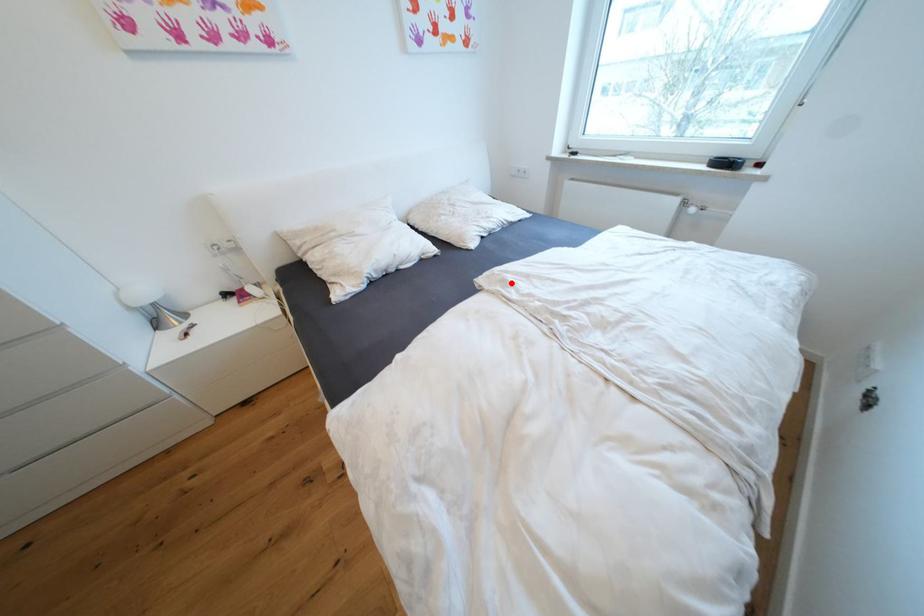
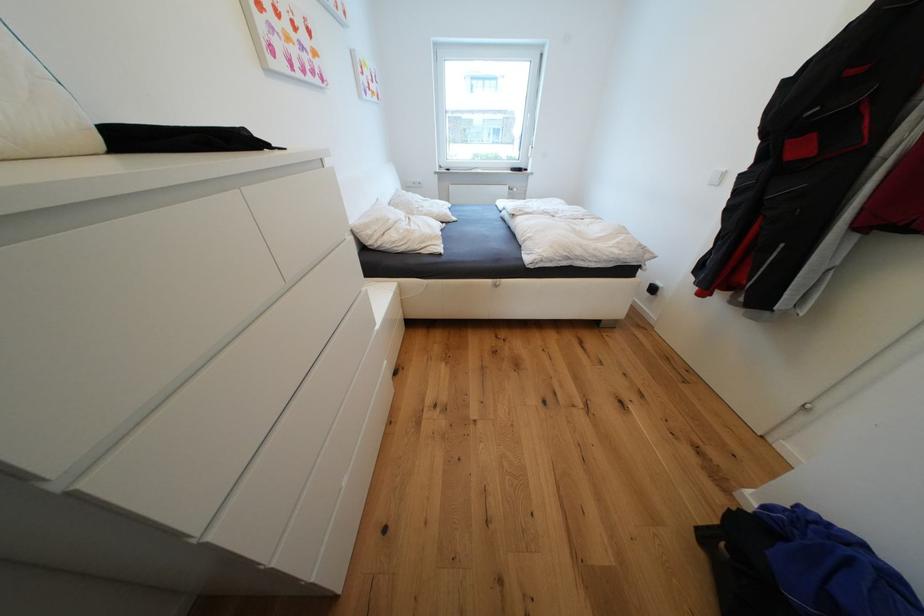
Question: I am providing you with two images of the same scene from different viewpoints. Image1 has a red point marked. In image2, the corresponding 3D location appears at what relative position? Reply with the corresponding letter.

Choices:
 (A) Closer
 (B) Farther

Answer: (A)